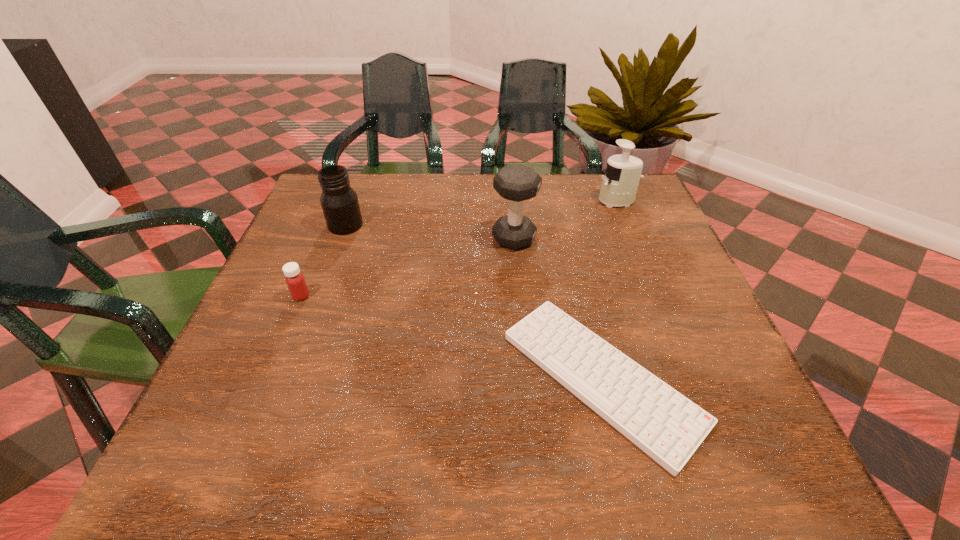
Where is `dumbbell`? The image size is (960, 540). dumbbell is located at coordinates (516, 183).

Where is `juicer`? The width and height of the screenshot is (960, 540). juicer is located at coordinates (621, 177).

The width and height of the screenshot is (960, 540). I want to click on jar, so click(x=339, y=202).

Locate an element on the screen. This screenshot has height=540, width=960. medicine is located at coordinates (296, 283).

At what (x,y) coordinates should I click in order to perform the action: click on the second shortest object. Please return your answer as a coordinate pair (x, y). The image size is (960, 540). Looking at the image, I should click on (296, 283).

At what (x,y) coordinates should I click in order to perform the action: click on the nearest object. Please return your answer as a coordinate pair (x, y). This screenshot has height=540, width=960. Looking at the image, I should click on (667, 426).

At what (x,y) coordinates should I click in order to perform the action: click on the shortest object. Please return your answer as a coordinate pair (x, y). Looking at the image, I should click on [667, 426].

You are a GUI agent. You are given a task and a screenshot of the screen. Output one action in this format:
    pyautogui.click(x=<x>, y=<y>)
    Task: Click on the vacant point located 0.150m on the right of the dumbbell
    The width and height of the screenshot is (960, 540).
    Given the screenshot: What is the action you would take?
    pyautogui.click(x=597, y=238)

Identify the location of free space located 0.110m on the front of the juicer. (630, 234).

Locate an element on the screen. free location located 0.060m on the left of the jar is located at coordinates (304, 225).